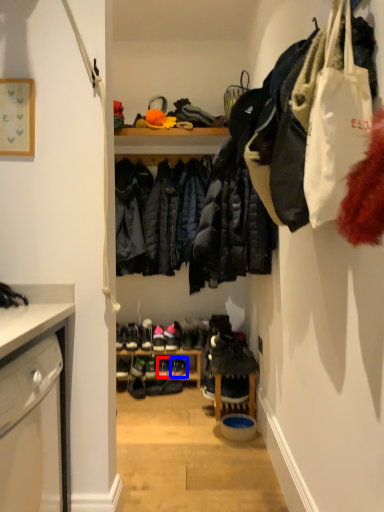
Question: Which object appears closest to the camera in this image, footwear (highlighted by a red box) or footwear (highlighted by a blue box)?

Choices:
 (A) footwear
 (B) footwear

Answer: (A)